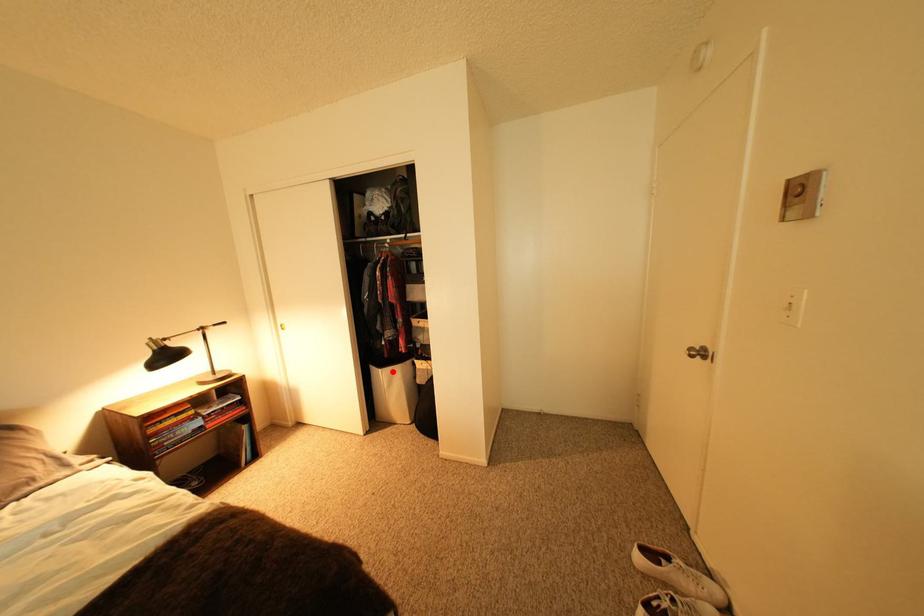
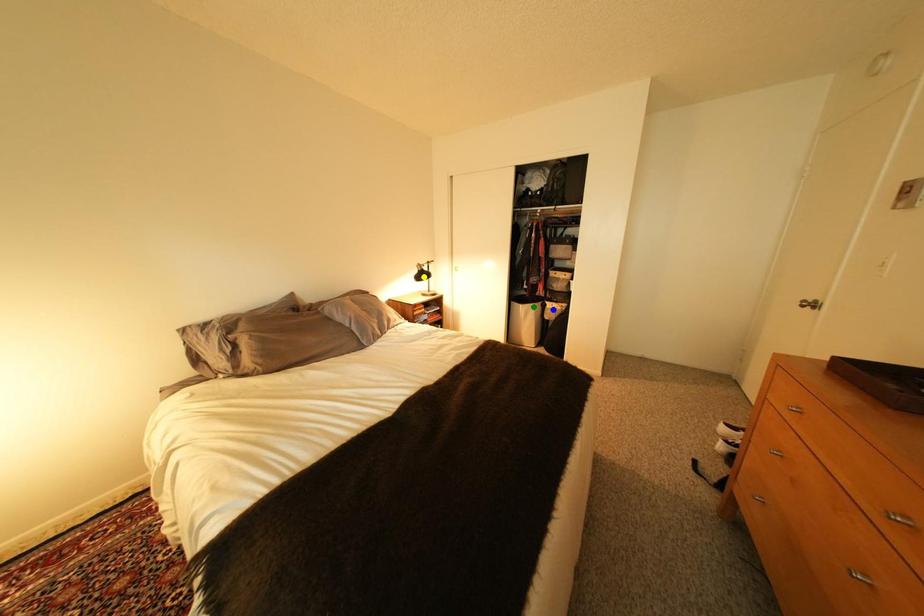
Question: I am providing you with two images of the same scene from different viewpoints. A red point is marked on the first image. You are given multiple points on the second image. Which point in image 2 is actually the same real-world point as the red point in image 1?

Choices:
 (A) yellow point
 (B) green point
 (C) blue point

Answer: (B)